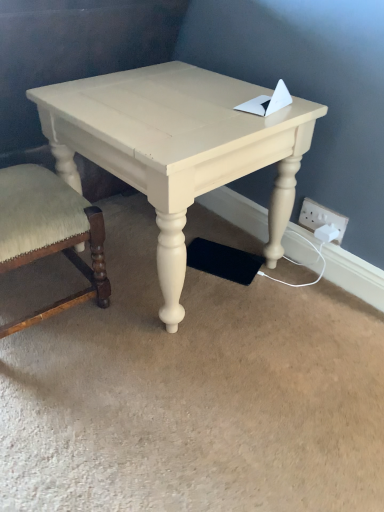
Locate an element on the screen. Image resolution: width=384 pixels, height=512 pixels. vacant space in front of velvet beige chair at lower left is located at coordinates click(x=52, y=382).